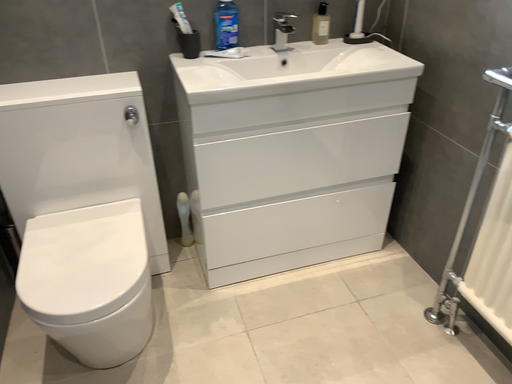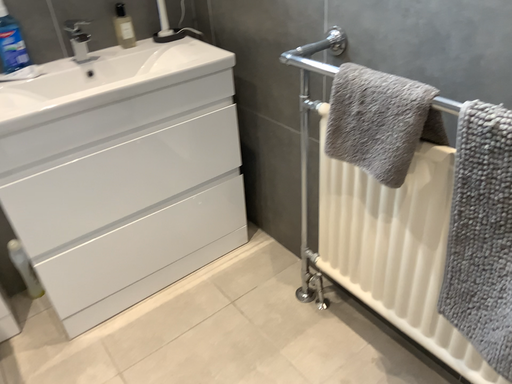
Question: How did the camera likely rotate when shooting the video?

Choices:
 (A) rotated right
 (B) rotated left

Answer: (A)